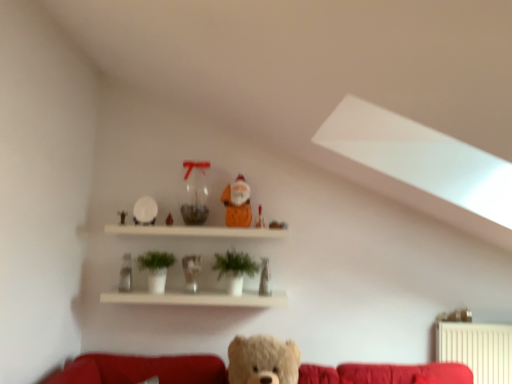
At what (x,y) coordinates should I click in order to perform the action: click on vacant area situated below transparent glass vase at center (from a real-world perspective). Please return your answer as a coordinate pair (x, y). The image size is (512, 384). Looking at the image, I should click on (192, 223).